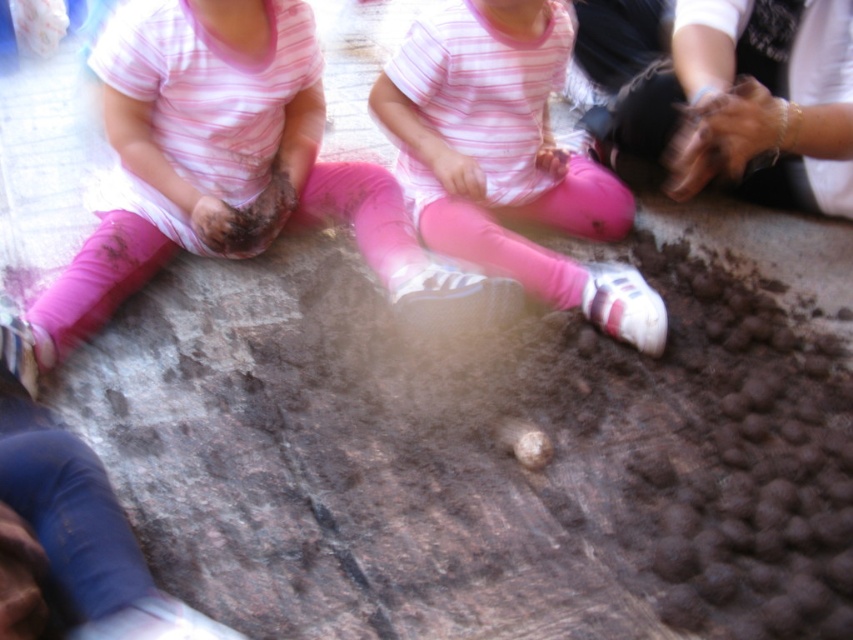
You are taking a photo of the two children sitting on the wooden surface. You want to focus on the point closer to the camera. Which point should you choose between point (177, 116) and point (637, 333)?

Point (177, 116) is further to the camera than point (637, 333), so you should choose point (177, 116) to focus on the closer point.

You are a photographer trying to capture a candid shot of the two children sitting on the wooden surface. Your camera has a maximum focus range of 12 inches. Can you focus on both the pink matte leggings at lower left and the pink fabric pants at center simultaneously?

The distance between the pink matte leggings at lower left and the pink fabric pants at center is 12.87 inches, which exceeds the camera maximum focus range of 12 inches. Therefore, you cannot focus on both simultaneously.